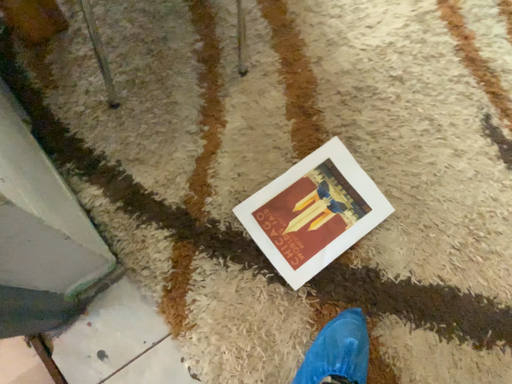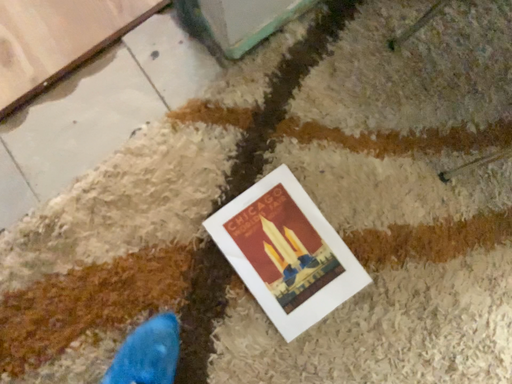
Question: Which way did the camera rotate in the video?

Choices:
 (A) rotated right
 (B) rotated left

Answer: (B)